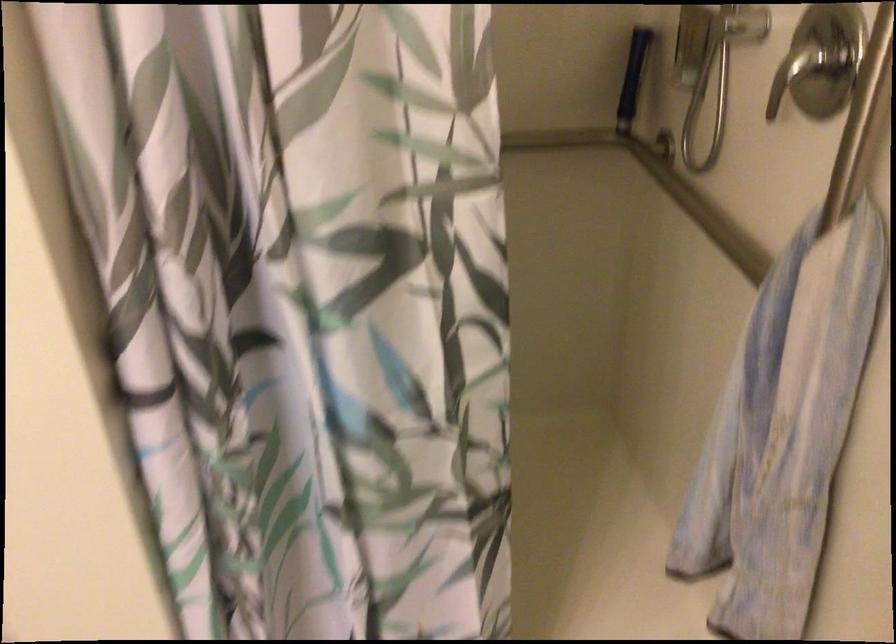
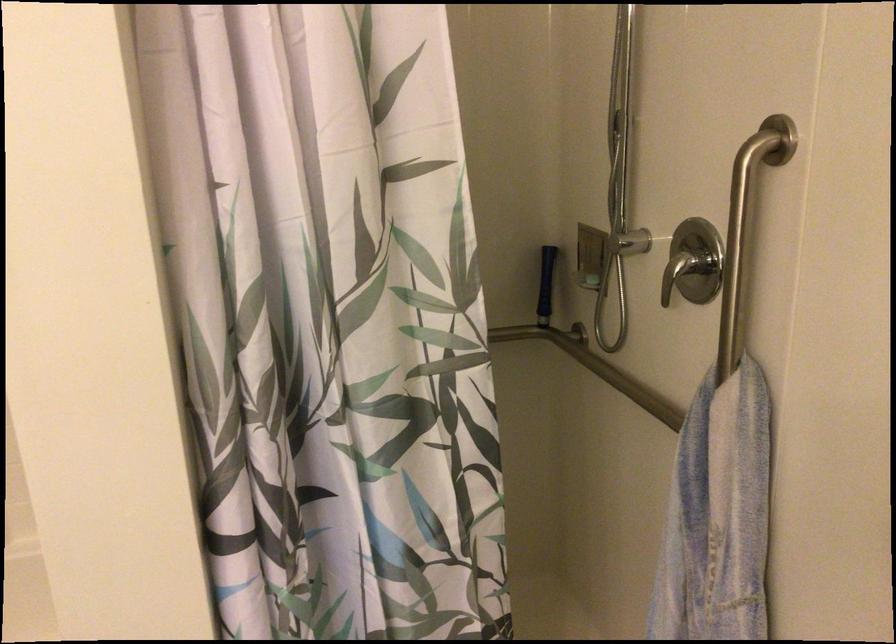
In the second image, find the point that corresponds to pixel 626 90 in the first image.

(546, 285)